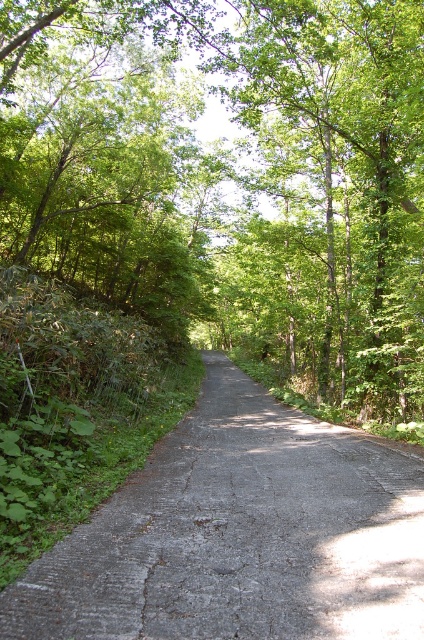
Can you confirm if green leafy tree at center is taller than gray asphalt road at center?

Indeed, green leafy tree at center has a greater height compared to gray asphalt road at center.

Is point (180, 282) positioned before point (256, 618)?

That is False.

Image resolution: width=424 pixels, height=640 pixels. What are the coordinates of `green leafy tree at center` in the screenshot? It's located at tap(231, 177).